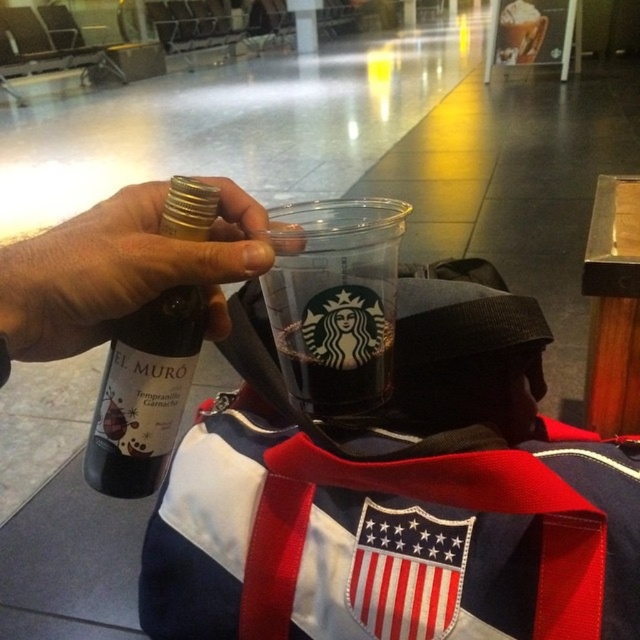
You are a traveler at an airport terminal. You have a matte glass bottle at upper left and a transparent plastic cup at center in your hand. You want to place both items on the tray for security screening. The tray is narrow and can only accommodate one item at a time. Which item should you place first to ensure the other can be placed afterward without moving the first?

You should place the matte glass bottle at upper left first because it is behind the transparent plastic cup at center, so putting it down first allows the cup to be placed afterward without obstruction.